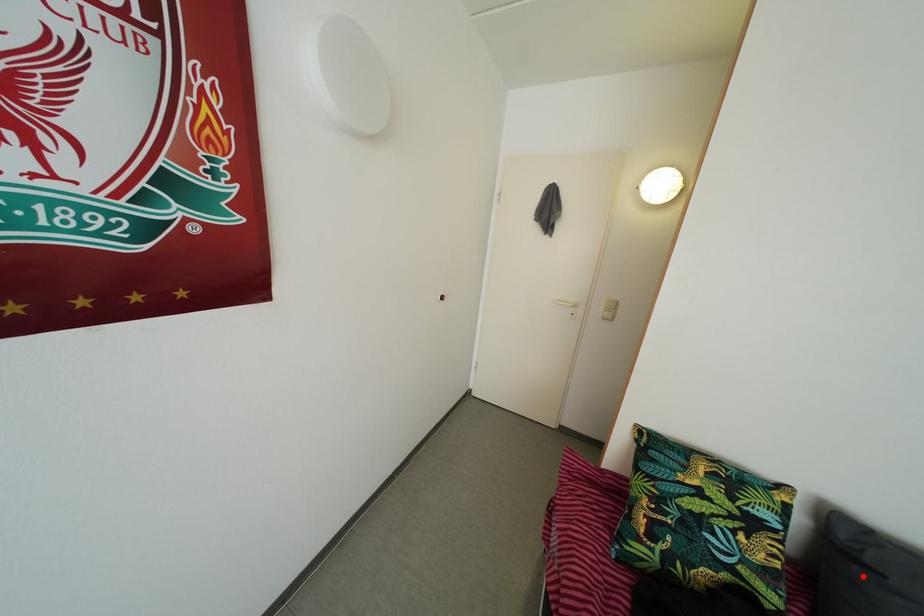
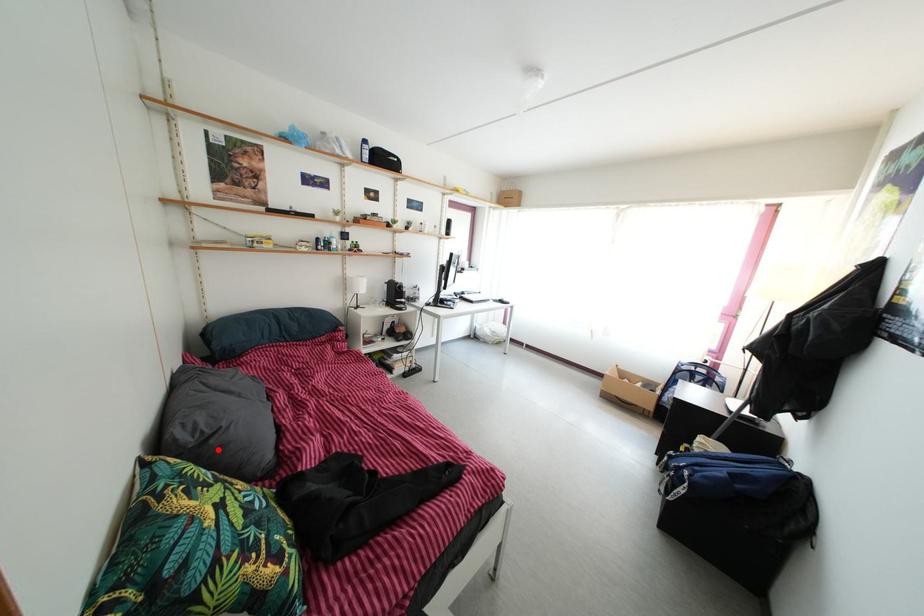
I am providing you with two images of the same scene from different viewpoints. A red point is marked on the first image and another point is marked on the second image. Is the marked point in image1 the same physical position as the marked point in image2?

Yes